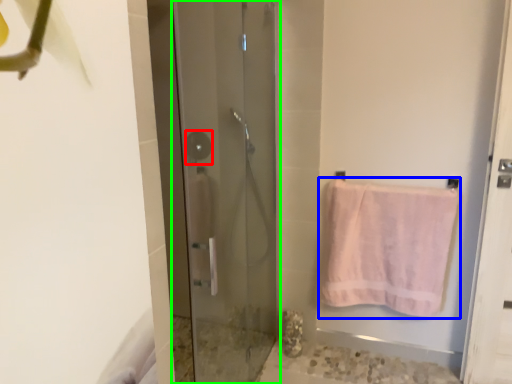
Question: Estimate the real-world distances between objects in this image. Which object is closer to shower (highlighted by a red box), towel (highlighted by a blue box) or door (highlighted by a green box)?

Choices:
 (A) towel
 (B) door

Answer: (B)